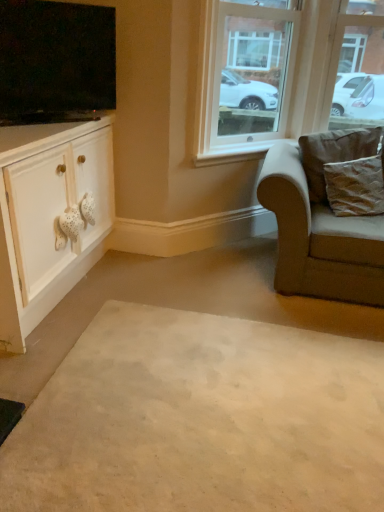
Question: Can you confirm if beige carpet at center is taller than flat screen tv at upper left?

Choices:
 (A) yes
 (B) no

Answer: (B)

Question: Is beige carpet at center outside flat screen tv at upper left?

Choices:
 (A) no
 (B) yes

Answer: (B)

Question: Does beige carpet at center have a greater width compared to flat screen tv at upper left?

Choices:
 (A) yes
 (B) no

Answer: (A)

Question: Can you confirm if beige carpet at center is smaller than flat screen tv at upper left?

Choices:
 (A) yes
 (B) no

Answer: (B)

Question: Is beige carpet at center next to flat screen tv at upper left?

Choices:
 (A) yes
 (B) no

Answer: (B)

Question: Considering the relative positions of beige carpet at center and flat screen tv at upper left in the image provided, is beige carpet at center to the right of flat screen tv at upper left from the viewer's perspective?

Choices:
 (A) yes
 (B) no

Answer: (A)

Question: Is clear glass window at upper center facing towards flat screen tv at upper left?

Choices:
 (A) yes
 (B) no

Answer: (B)

Question: Considering the relative sizes of clear glass window at upper center and flat screen tv at upper left in the image provided, is clear glass window at upper center thinner than flat screen tv at upper left?

Choices:
 (A) no
 (B) yes

Answer: (A)

Question: Is there a large distance between clear glass window at upper center and flat screen tv at upper left?

Choices:
 (A) no
 (B) yes

Answer: (A)

Question: Is clear glass window at upper center placed right next to flat screen tv at upper left?

Choices:
 (A) yes
 (B) no

Answer: (B)

Question: From a real-world perspective, is clear glass window at upper center on flat screen tv at upper left?

Choices:
 (A) no
 (B) yes

Answer: (A)

Question: Is clear glass window at upper center closer to the viewer compared to flat screen tv at upper left?

Choices:
 (A) yes
 (B) no

Answer: (B)

Question: From the image's perspective, would you say white matte cabinet at left is shown under flat screen tv at upper left?

Choices:
 (A) yes
 (B) no

Answer: (A)